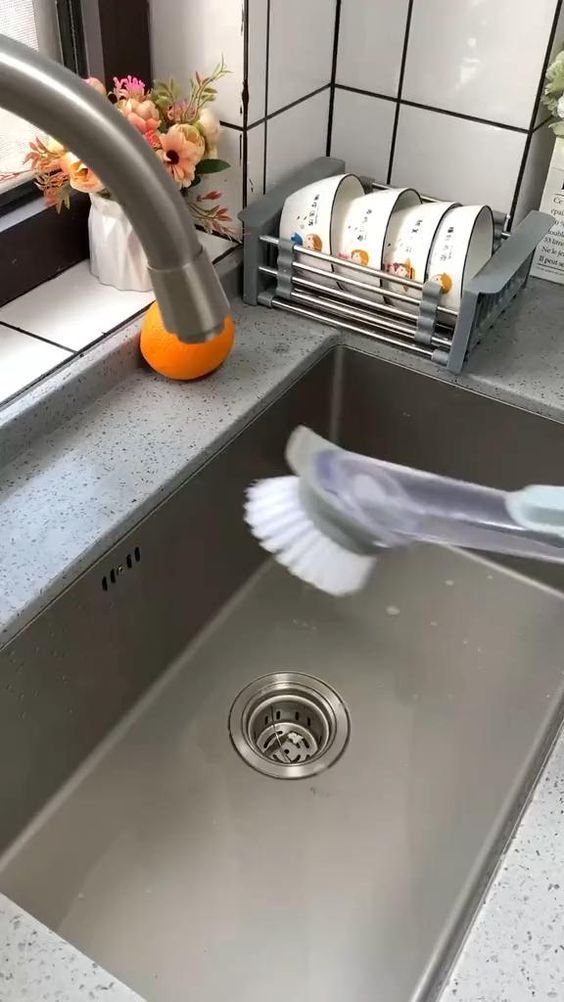
You are a GUI agent. You are given a task and a screenshot of the screen. Output one action in this format:
    pyautogui.click(x=<x>, y=<y>)
    Task: Click on the window sill
    Image resolution: width=564 pixels, height=1002 pixels.
    Given the screenshot: What is the action you would take?
    pyautogui.click(x=39, y=256)